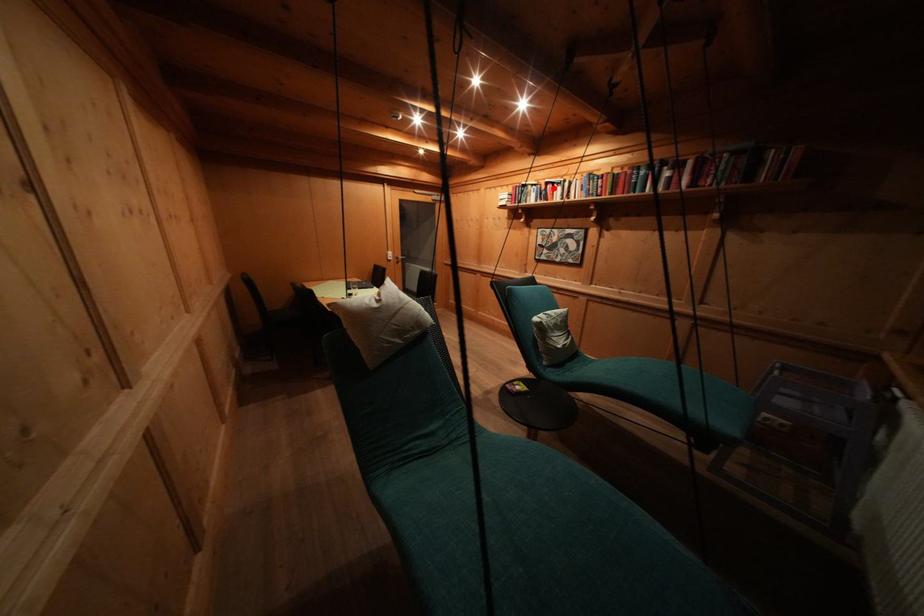
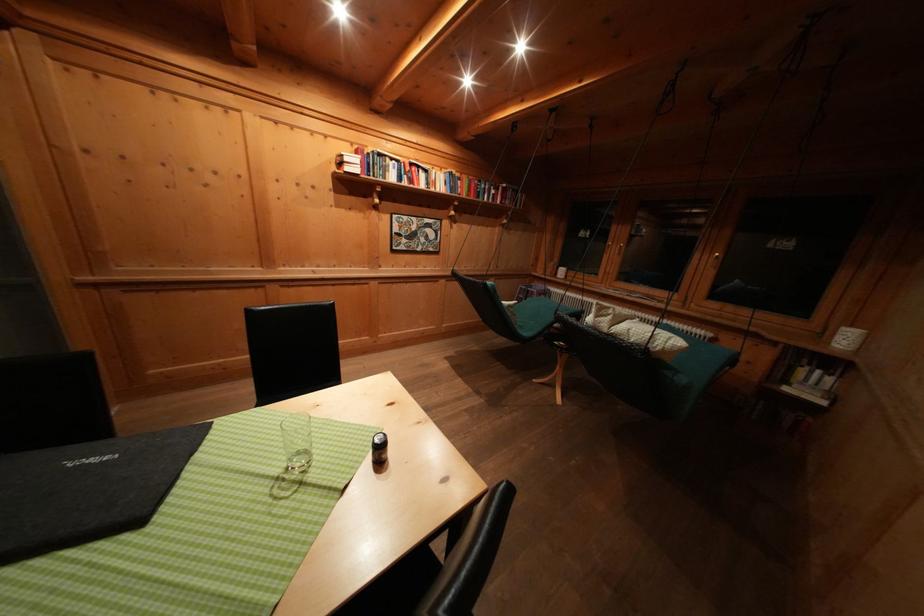
The point at the highlighted location is marked in the first image. Where is the corresponding point in the second image?

(418, 169)